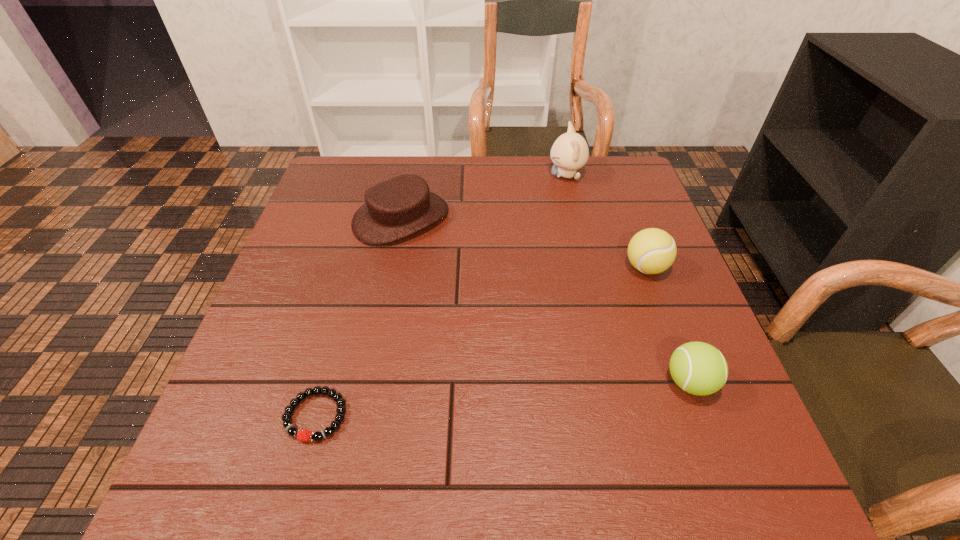
Identify the location of free space located 0.110m on the left of the second farthest object. The height and width of the screenshot is (540, 960). pos(312,218).

At what (x,y) coordinates should I click in order to perform the action: click on vacant point located 0.120m on the back of the nearer tennis ball. Please return your answer as a coordinate pair (x, y). Looking at the image, I should click on (663, 313).

Locate an element on the screen. The image size is (960, 540). blank area located on the right of the bracelet is located at coordinates [x=416, y=415].

Identify the location of kitten located in the far edge section of the desktop. (570, 152).

Where is `hat located at the far edge`? The width and height of the screenshot is (960, 540). hat located at the far edge is located at coordinates pos(403,205).

Identify the location of hat present at the left edge. (403, 205).

Locate an element on the screen. This screenshot has width=960, height=540. bracelet located at the left edge is located at coordinates (292, 431).

Find the location of a particular element. The image size is (960, 540). kitten at the right edge is located at coordinates (570, 152).

Locate an element on the screen. Image resolution: width=960 pixels, height=540 pixels. object located in the far left corner section of the desktop is located at coordinates (403, 205).

The image size is (960, 540). I want to click on object at the far right corner, so click(570, 152).